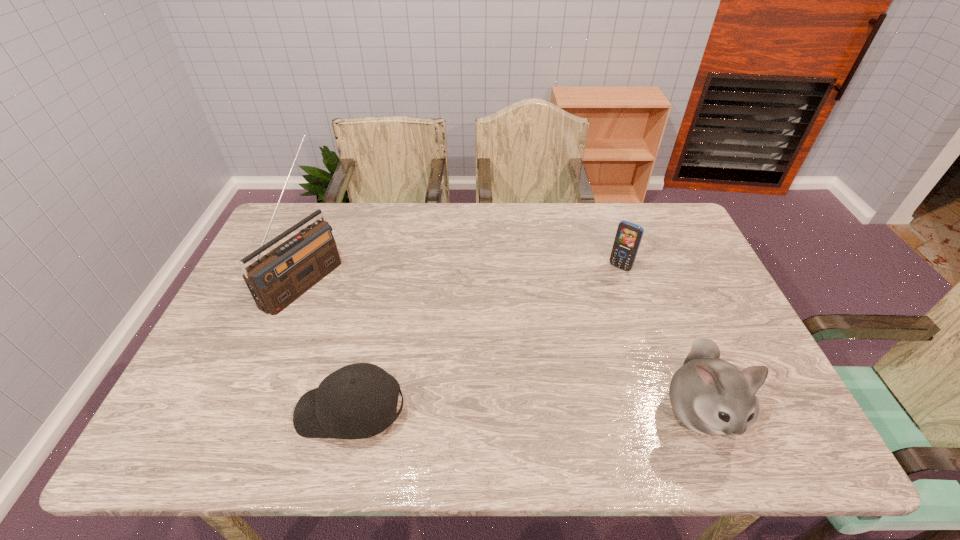
Locate an element on the screen. The height and width of the screenshot is (540, 960). free space on the desktop that is between the second object from left to right and the hamster and is positioned on the front-facing side of the tallest object is located at coordinates (549, 411).

Find the location of a particular element. Image resolution: width=960 pixels, height=540 pixels. vacant spot on the desktop that is between the third object from right to left and the hamster and is positioned on the screen of the cellular telephone is located at coordinates (506, 411).